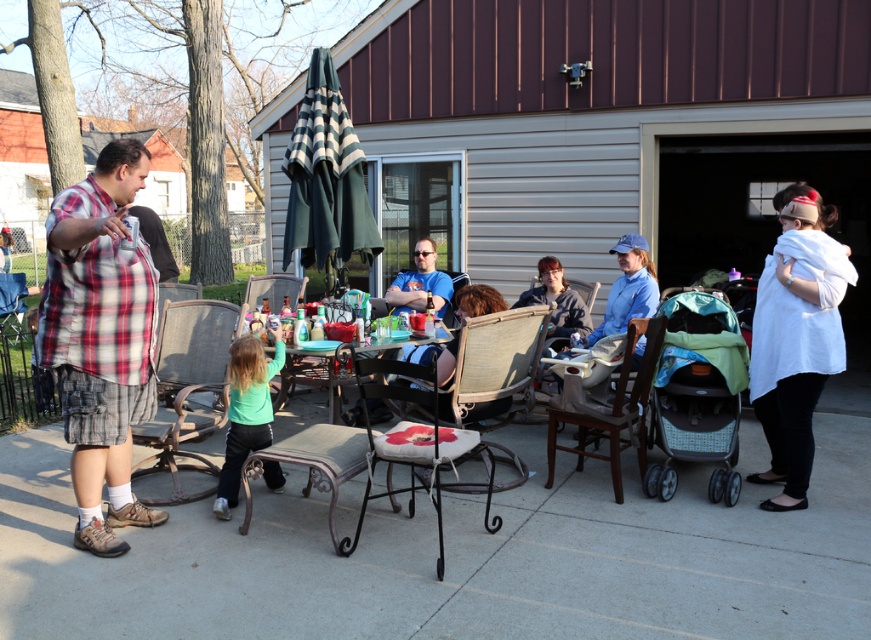
Between point (180, 490) and point (396, 397), which one is positioned in front?

Positioned in front is point (396, 397).

Which is more to the right, metallic gray chair at center or white fabric cushioned chair at center?

white fabric cushioned chair at center

Find the location of a particular element. metallic gray chair at center is located at coordinates (187, 387).

Does woven rattan chair at center have a lesser width compared to clear glass table at center?

Yes, woven rattan chair at center is thinner than clear glass table at center.

Which is behind, point (529, 328) or point (292, 353)?

The point (292, 353) is more distant.

Where is `woven rattan chair at center`? The width and height of the screenshot is (871, 640). woven rattan chair at center is located at coordinates (497, 358).

Is white fabric cushioned chair at center below wooden chair at center?

Yes, white fabric cushioned chair at center is below wooden chair at center.

Between white fabric cushioned chair at center and wooden chair at center, which one is positioned lower?

Positioned lower is white fabric cushioned chair at center.

Who is more forward, [382,438] or [606,428]?

Positioned in front is point [382,438].

The height and width of the screenshot is (640, 871). What are the coordinates of `white fabric cushioned chair at center` in the screenshot? It's located at (407, 440).